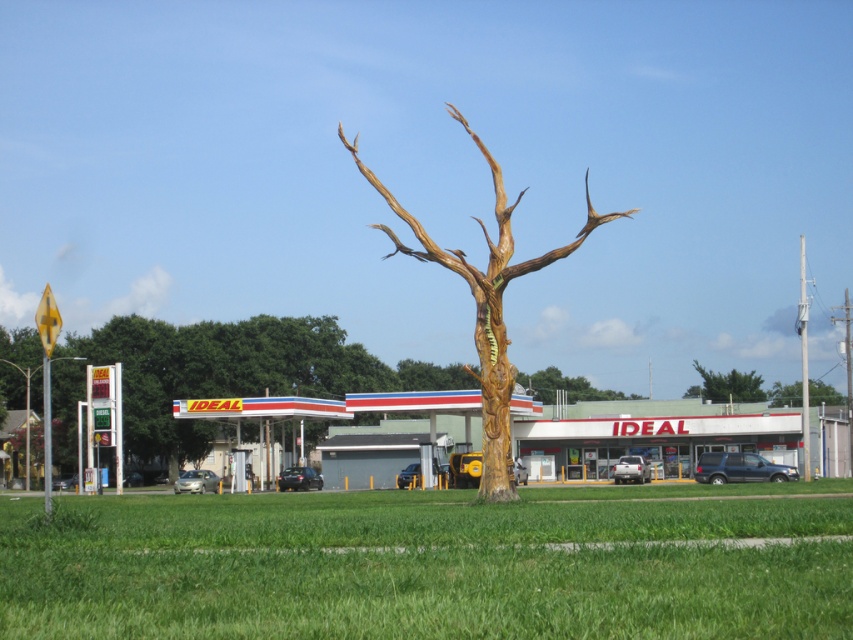
Question: Among these points, which one is farthest from the camera?

Choices:
 (A) (474, 333)
 (B) (767, 429)
 (C) (715, 371)

Answer: (C)

Question: Among these points, which one is farthest from the camera?

Choices:
 (A) (x=442, y=259)
 (B) (x=387, y=428)

Answer: (B)

Question: Which object appears closest to the camera in this image?

Choices:
 (A) green textured tree at upper center
 (B) wooden tree trunk at center
 (C) wooden textured tree at center

Answer: (C)

Question: Where is wooden textured tree at center located in relation to green textured tree at upper center in the image?

Choices:
 (A) right
 (B) left

Answer: (B)

Question: Does wooden tree trunk at center lie behind brown wood tree at center?

Choices:
 (A) yes
 (B) no

Answer: (B)

Question: Can you confirm if wooden tree trunk at center is thinner than green textured tree at upper center?

Choices:
 (A) yes
 (B) no

Answer: (A)